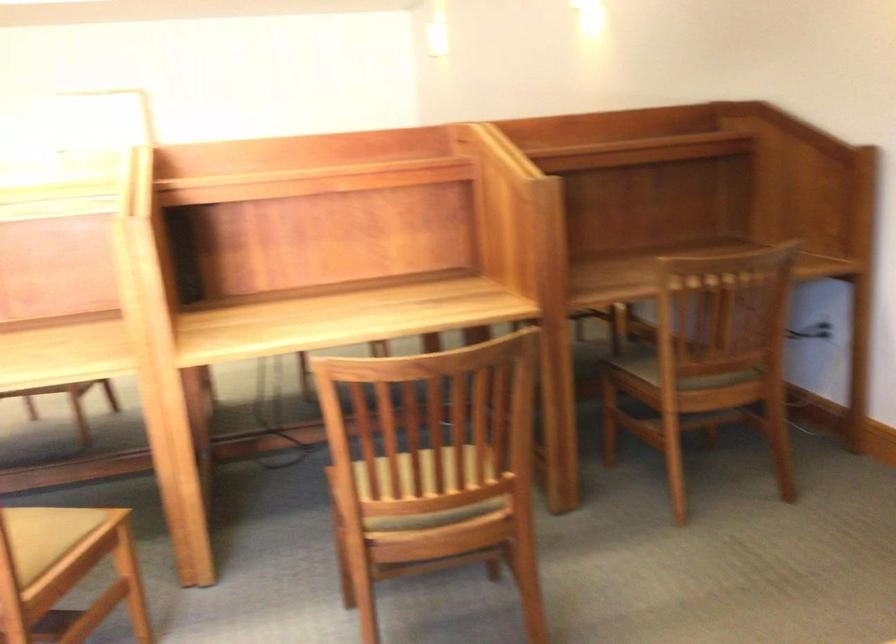
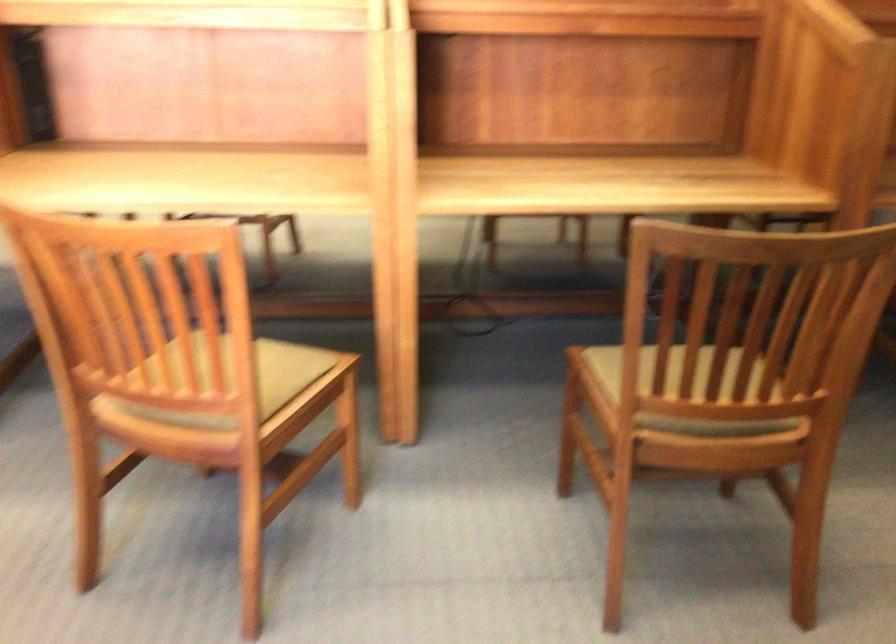
Question: The images are taken continuously from a first-person perspective. In which direction is your viewpoint rotating?

Choices:
 (A) Left
 (B) Right
 (C) Up
 (D) Down

Answer: (D)